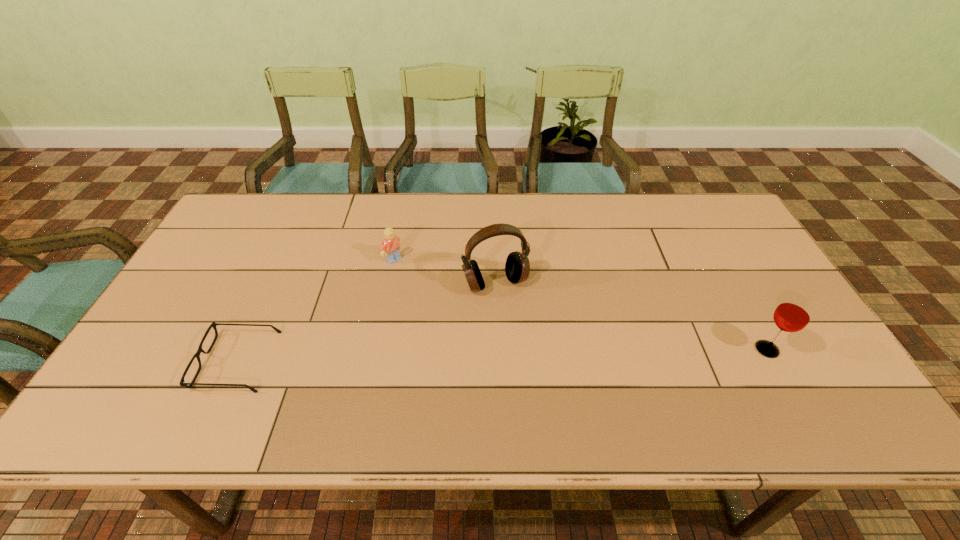
The image size is (960, 540). I want to click on empty location between the third tallest object and the headset, so click(x=444, y=271).

The height and width of the screenshot is (540, 960). In order to click on empty space that is in between the farthest object and the rightmost object in this screenshot , I will do `click(581, 305)`.

Find the location of a particular element. The height and width of the screenshot is (540, 960). vacant region between the third object from right to left and the third object from left to right is located at coordinates point(444,271).

The height and width of the screenshot is (540, 960). In order to click on empty space that is in between the third object from left to right and the leftmost object in this screenshot , I will do `click(366, 322)`.

Find the location of a particular element. The width and height of the screenshot is (960, 540). free space between the third nearest object and the rightmost object is located at coordinates (631, 316).

Locate an element on the screen. The image size is (960, 540). vacant area between the glass and the headset is located at coordinates (631, 316).

Where is `object identified as the second closest to the rightmost object`? object identified as the second closest to the rightmost object is located at coordinates (390, 247).

You are a GUI agent. You are given a task and a screenshot of the screen. Output one action in this format:
    pyautogui.click(x=<x>, y=<y>)
    Task: Click on the object identified as the third closest to the third object from left to right
    
    Given the screenshot: What is the action you would take?
    pyautogui.click(x=793, y=314)

At what (x,y) coordinates should I click in order to perform the action: click on vacant space that satisfies the following two spatial constraints: 1. on the front side of the third tallest object; 2. on the left side of the glass. Please return your answer as a coordinate pair (x, y). The width and height of the screenshot is (960, 540). Looking at the image, I should click on (375, 349).

Where is `vacant area that satisfies the following two spatial constraints: 1. on the front side of the glass; 2. on the right side of the headset`? This screenshot has width=960, height=540. vacant area that satisfies the following two spatial constraints: 1. on the front side of the glass; 2. on the right side of the headset is located at coordinates (497, 349).